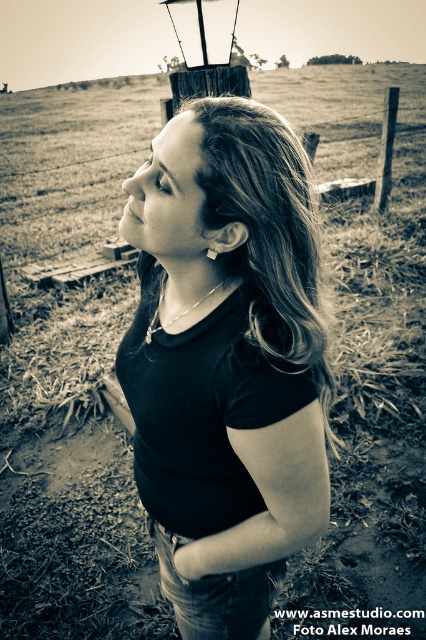
Question: Is black matte shirt at center bigger than dirt field at center?

Choices:
 (A) no
 (B) yes

Answer: (A)

Question: Which point is farther to the camera?

Choices:
 (A) dirt field at center
 (B) black matte shirt at center

Answer: (A)

Question: Which point is closer to the camera taking this photo?

Choices:
 (A) (x=227, y=627)
 (B) (x=353, y=252)

Answer: (A)

Question: Does black matte shirt at center have a greater width compared to dirt field at center?

Choices:
 (A) yes
 (B) no

Answer: (B)

Question: Which point is farther to the camera?

Choices:
 (A) (293, 180)
 (B) (400, 172)

Answer: (B)

Question: Does black matte shirt at center appear on the left side of dirt field at center?

Choices:
 (A) yes
 (B) no

Answer: (B)